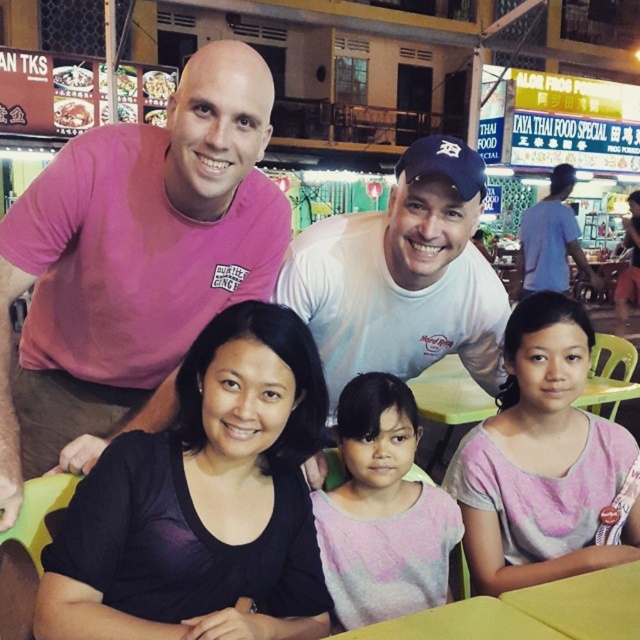
Question: Which point appears closest to the camera in this image?

Choices:
 (A) (61, 109)
 (B) (307, 634)
 (C) (529, 260)
 (D) (406, 417)

Answer: (B)

Question: Can you confirm if black matte shirt at center is thinner than blue cotton shirt at upper right?

Choices:
 (A) yes
 (B) no

Answer: (A)

Question: Among these points, which one is nearest to the camera?

Choices:
 (A) (416, 563)
 (B) (308, 580)

Answer: (B)

Question: Estimate the real-world distances between objects in this image. Which object is closer to the pink cotton shirt at upper left?

Choices:
 (A) white glossy noodles at upper left
 (B) pink cotton shirt at lower right
 (C) pink cotton shirt at center

Answer: (C)

Question: Is pink cotton shirt at upper left thinner than pink cotton shirt at center?

Choices:
 (A) yes
 (B) no

Answer: (B)

Question: Can you confirm if matte brown rice at upper left is thinner than white glossy noodles at upper left?

Choices:
 (A) yes
 (B) no

Answer: (B)